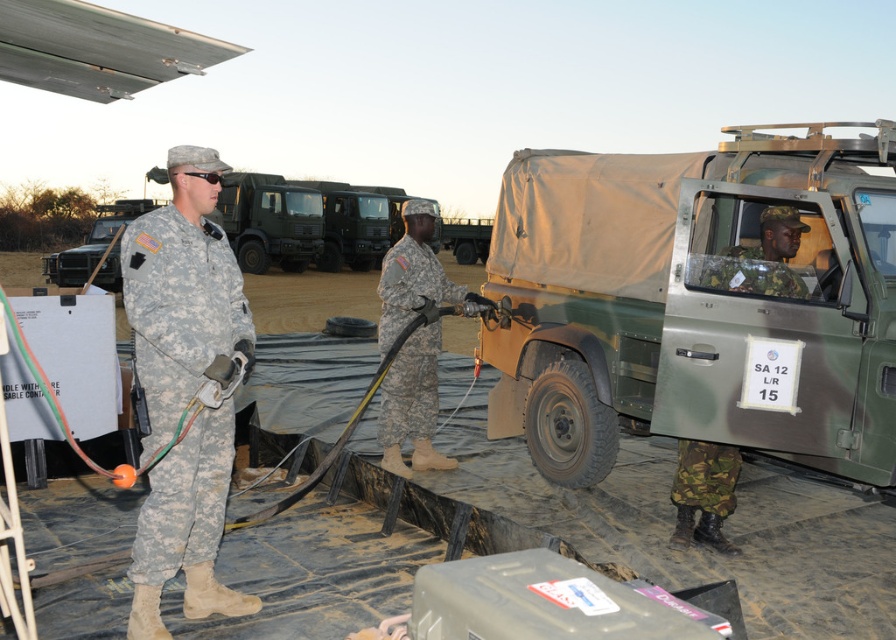
Question: Can you confirm if green matte truck at center is wider than camouflage fabric uniform at left?

Choices:
 (A) yes
 (B) no

Answer: (A)

Question: Which of the following is the closest to the observer?

Choices:
 (A) camouflage fabric uniform at left
 (B) green matte truck at center
 (C) camouflage fabric uniform at center
 (D) camouflage fabric uniform at right

Answer: (A)

Question: Is green matte truck at center closer to camera compared to camouflage fabric uniform at center?

Choices:
 (A) yes
 (B) no

Answer: (A)

Question: Among these objects, which one is nearest to the camera?

Choices:
 (A) camouflage fabric uniform at left
 (B) camouflage fabric uniform at right
 (C) camouflage fabric uniform at center
 (D) green matte truck at center

Answer: (A)

Question: Which is nearer to the camouflage fabric uniform at center?

Choices:
 (A) green matte truck at center
 (B) camouflage fabric uniform at right

Answer: (A)

Question: Is green matte truck at center positioned behind camouflage fabric uniform at center?

Choices:
 (A) yes
 (B) no

Answer: (B)